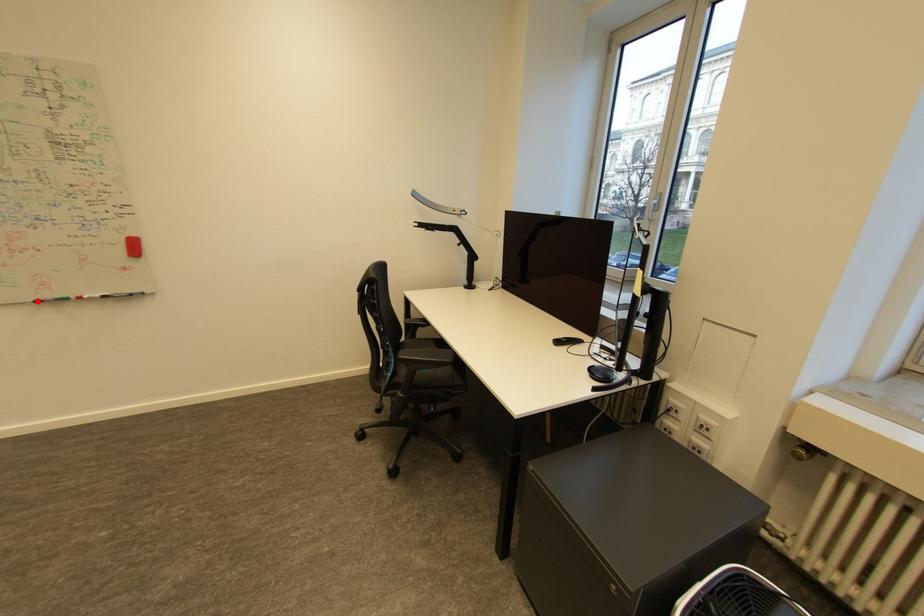
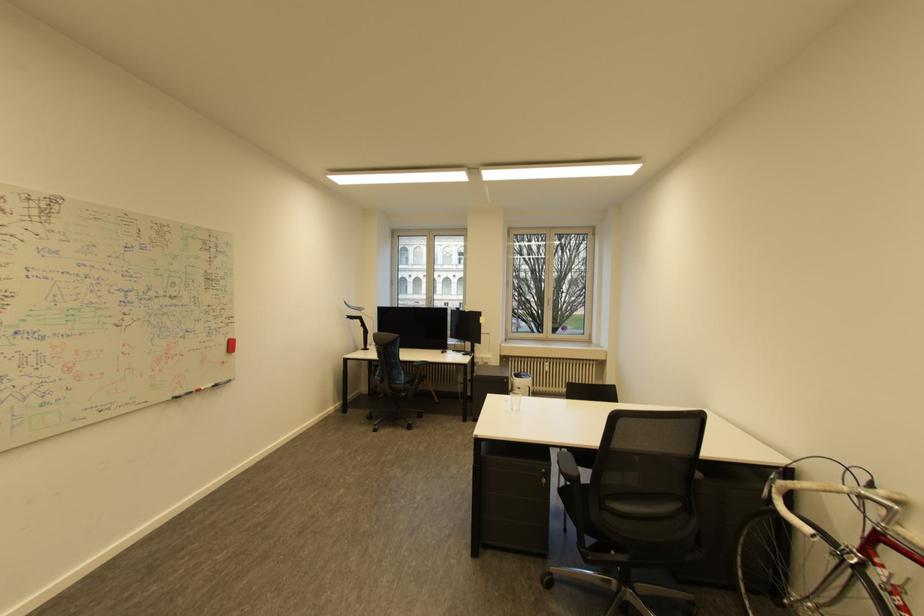
Where in the second image is the point corresponding to the highlighted location from the first image?

(176, 399)